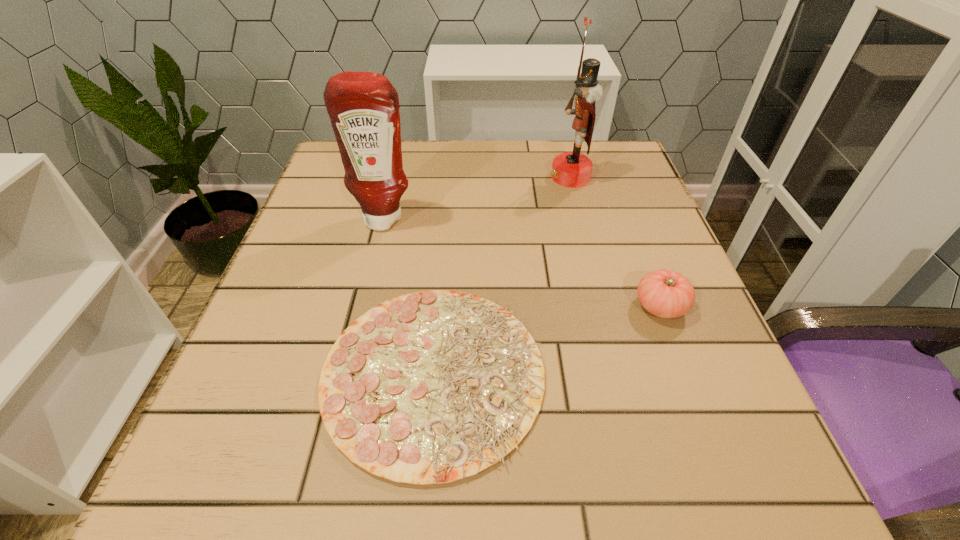
Locate an element on the screen. vacant point located 0.280m on the left of the rightmost object is located at coordinates (468, 306).

In order to click on free location located on the back of the shortest object in this screenshot , I will do `click(451, 170)`.

Locate an element on the screen. The image size is (960, 540). object that is at the far edge is located at coordinates (569, 169).

At what (x,y) coordinates should I click in order to perform the action: click on object at the near edge. Please return your answer as a coordinate pair (x, y). Looking at the image, I should click on (430, 387).

Where is `condiment present at the left edge`? Image resolution: width=960 pixels, height=540 pixels. condiment present at the left edge is located at coordinates (363, 107).

The image size is (960, 540). Identify the location of pizza at the left edge. (430, 387).

The width and height of the screenshot is (960, 540). I want to click on nutcracker that is at the right edge, so click(569, 169).

You are a GUI agent. You are given a task and a screenshot of the screen. Output one action in this format:
    pyautogui.click(x=<x>, y=<y>)
    Task: Click on the tomato at the right edge
    The image size is (960, 540).
    Given the screenshot: What is the action you would take?
    pyautogui.click(x=664, y=293)

Image resolution: width=960 pixels, height=540 pixels. Find the location of `object that is at the near left corner`. object that is at the near left corner is located at coordinates (430, 387).

I want to click on object that is positioned at the far right corner, so click(x=569, y=169).